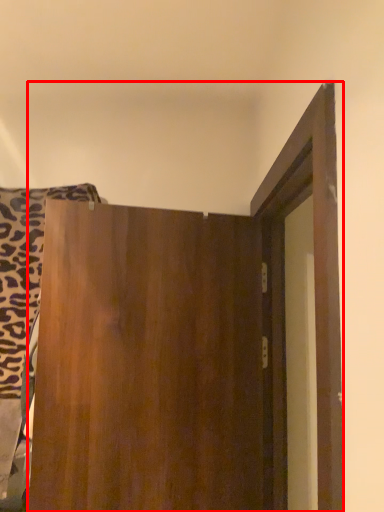
Question: Where is door (annotated by the red box) located in relation to laundry in the image?

Choices:
 (A) right
 (B) left

Answer: (A)